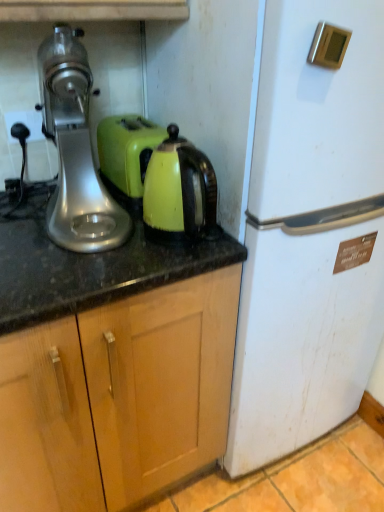
Image resolution: width=384 pixels, height=512 pixels. Identify the location of vacant area situated to the left side of matte green kettle at center. (115, 238).